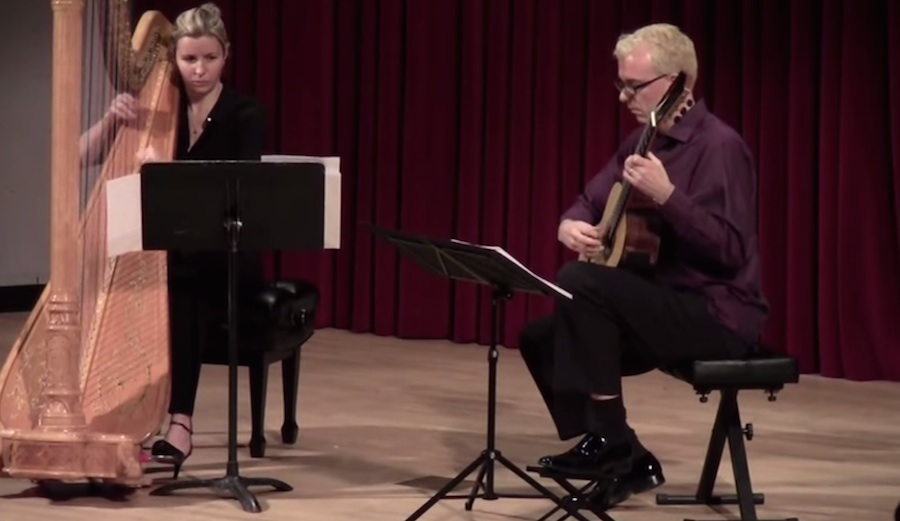
The width and height of the screenshot is (900, 521). I want to click on black bench, so click(x=303, y=318).